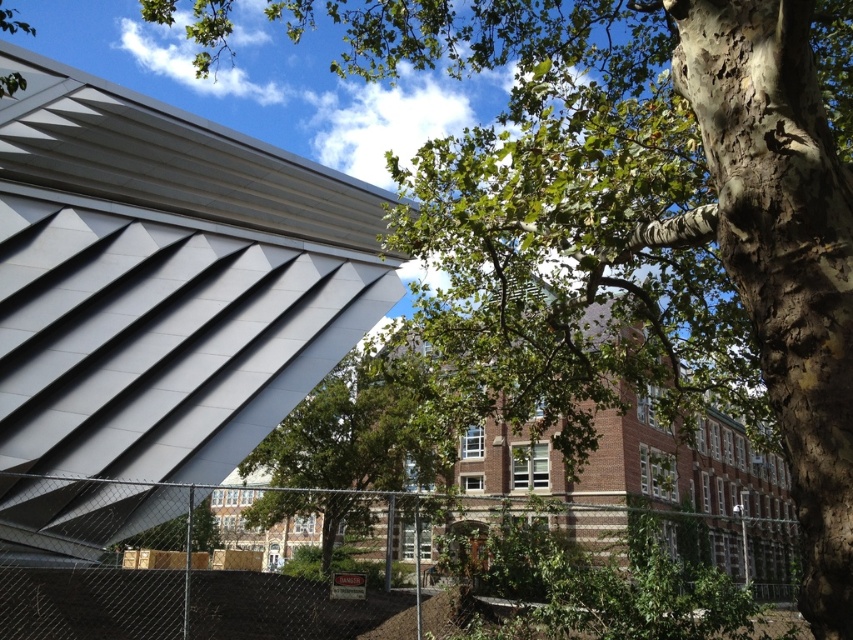
Can you confirm if metallic silver roof at upper left is smaller than green chain-link fence at center?

Indeed, metallic silver roof at upper left has a smaller size compared to green chain-link fence at center.

Between metallic silver roof at upper left and green chain-link fence at center, which one is positioned higher?

Positioned higher is metallic silver roof at upper left.

Who is more forward, [155,168] or [163,572]?

Point [163,572] is in front.

The height and width of the screenshot is (640, 853). I want to click on metallic silver roof at upper left, so click(164, 282).

Is metallic silver roof at upper left taller than green leafy tree at center?

Correct, metallic silver roof at upper left is much taller as green leafy tree at center.

Is metallic silver roof at upper left thinner than green leafy tree at center?

Correct, metallic silver roof at upper left's width is less than green leafy tree at center's.

This screenshot has height=640, width=853. What do you see at coordinates (164, 282) in the screenshot?
I see `metallic silver roof at upper left` at bounding box center [164, 282].

This screenshot has width=853, height=640. What are the coordinates of `metallic silver roof at upper left` in the screenshot? It's located at (164, 282).

Between green chain-link fence at center and green leafy tree at center, which one has more height?

Standing taller between the two is green leafy tree at center.

Can you confirm if green chain-link fence at center is positioned to the left of green leafy tree at center?

Indeed, green chain-link fence at center is positioned on the left side of green leafy tree at center.

Identify the location of green chain-link fence at center. (175, 577).